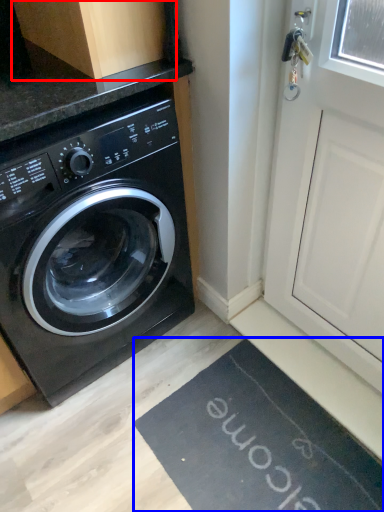
Question: Which object appears farthest to the camera in this image, cabinetry (highlighted by a red box) or bath mat (highlighted by a blue box)?

Choices:
 (A) cabinetry
 (B) bath mat

Answer: (B)